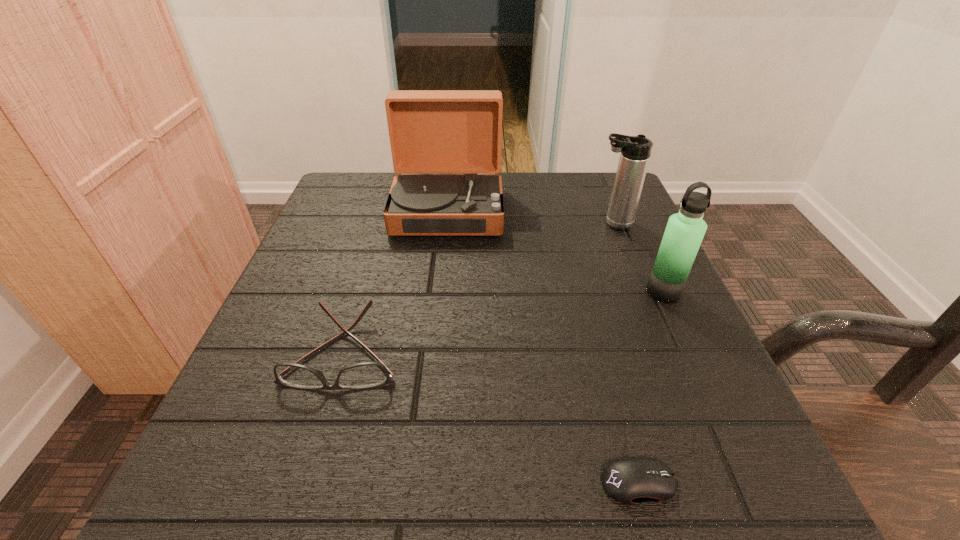
Point out which object is positioned as the second nearest to the farther thermos bottle. Please provide its 2D coordinates. Your answer should be formatted as a tuple, i.e. [(x, y)], where the tuple contains the x and y coordinates of a point satisfying the conditions above.

[(431, 131)]

The image size is (960, 540). In order to click on vacant area that satisfies the following two spatial constraints: 1. on the face of the nearest object; 2. on the right side of the phonograph record in this screenshot , I will do `click(420, 483)`.

This screenshot has height=540, width=960. What are the coordinates of `vacant space that satisfies the following two spatial constraints: 1. on the front-facing side of the computer equipment; 2. on the right side of the second shortest object` in the screenshot? It's located at (306, 483).

This screenshot has height=540, width=960. Find the location of `free space in the image that satisfies the following two spatial constraints: 1. on the handle side of the farther thermos bottle; 2. on the front side of the third object from right to left`. free space in the image that satisfies the following two spatial constraints: 1. on the handle side of the farther thermos bottle; 2. on the front side of the third object from right to left is located at coordinates (716, 483).

The width and height of the screenshot is (960, 540). Find the location of `blank space that satisfies the following two spatial constraints: 1. on the face of the third object from left to right; 2. on the right side of the phonograph record`. blank space that satisfies the following two spatial constraints: 1. on the face of the third object from left to right; 2. on the right side of the phonograph record is located at coordinates (420, 483).